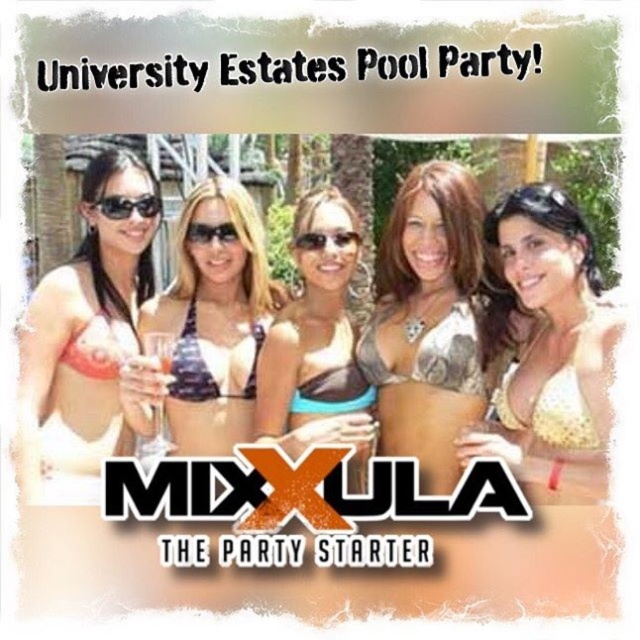
Question: Which object is positioned closest to the matte black sunglasses at center?

Choices:
 (A) matte white bikini top at left
 (B) yellow printed bikini top at center
 (C) black matte bikini top at center

Answer: (C)

Question: Considering the real-world distances, which object is closest to the black plastic sunglasses at center?

Choices:
 (A) camouflage bikini top at center
 (B) black plastic sunglasses at left
 (C) teal bikini top at center
 (D) matte white bikini top at left

Answer: (B)

Question: Which object is closer to the camera taking this photo?

Choices:
 (A) black matte bikini top at center
 (B) white bikini top at center

Answer: (B)

Question: Is the position of matte white bikini top at left more distant than that of black plastic sunglasses at center?

Choices:
 (A) yes
 (B) no

Answer: (B)

Question: Is matte white bikini top at left closer to camera compared to black plastic sunglasses at center?

Choices:
 (A) yes
 (B) no

Answer: (A)

Question: Considering the relative positions of yellow printed bikini top at center and matte white bikini top at left in the image provided, where is yellow printed bikini top at center located with respect to matte white bikini top at left?

Choices:
 (A) left
 (B) right

Answer: (B)